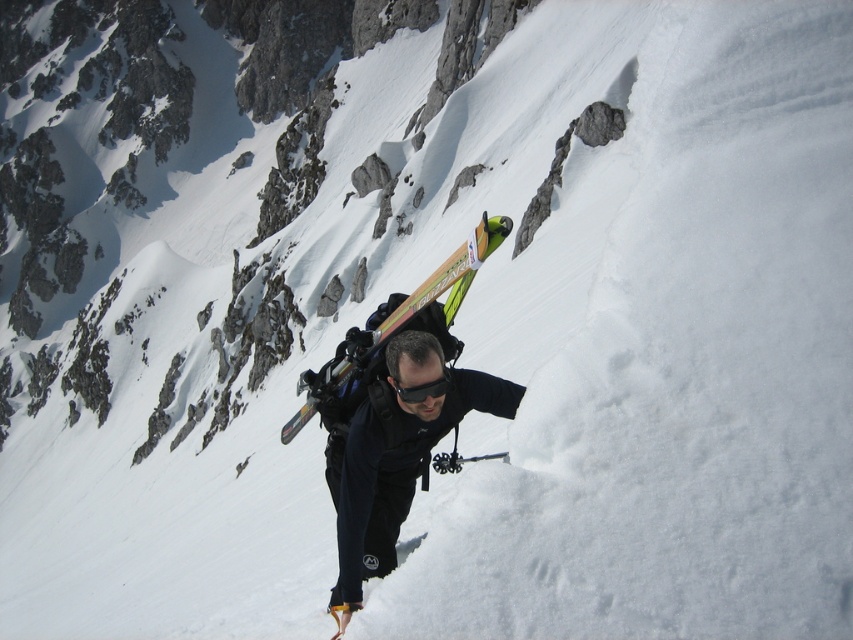
You are a photographer trying to capture the person in the scene. You notice the black matte jacket at center and the black matte goggles at center. Which object is closer to the camera based on their positions?

The black matte jacket at center is positioned under the black matte goggles at center, so the goggles are closer to the camera since they are above the jacket.

You are a mountain guide assessing the safety of a skier ascending a steep slope. The skier is wearing a black matte jacket at center and carrying a matte wood ski at center. Based on their position, is the jacket above or below the ski?

The black matte jacket at center is positioned under matte wood ski at center, so the jacket is below the ski.

You are a mountain guide assessing the safety of a skier carrying their gear. You notice the black matte jacket at center and the matte wood ski at center. Which item is positioned closer to the front of the skier?

The black matte jacket at center is positioned closer to the front of the skier because the matte wood ski at center is behind it.